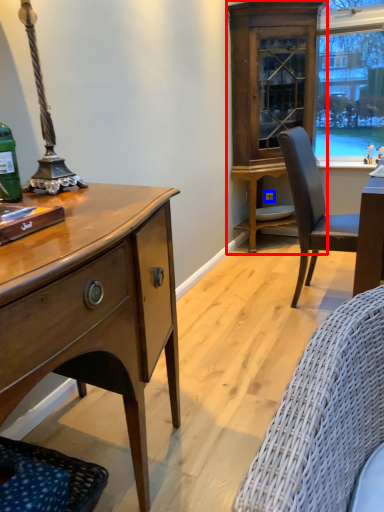
Question: Which of the following is the closest to the observer, cabinetry (highlighted by a red box) or power outlet (highlighted by a blue box)?

Choices:
 (A) cabinetry
 (B) power outlet

Answer: (A)